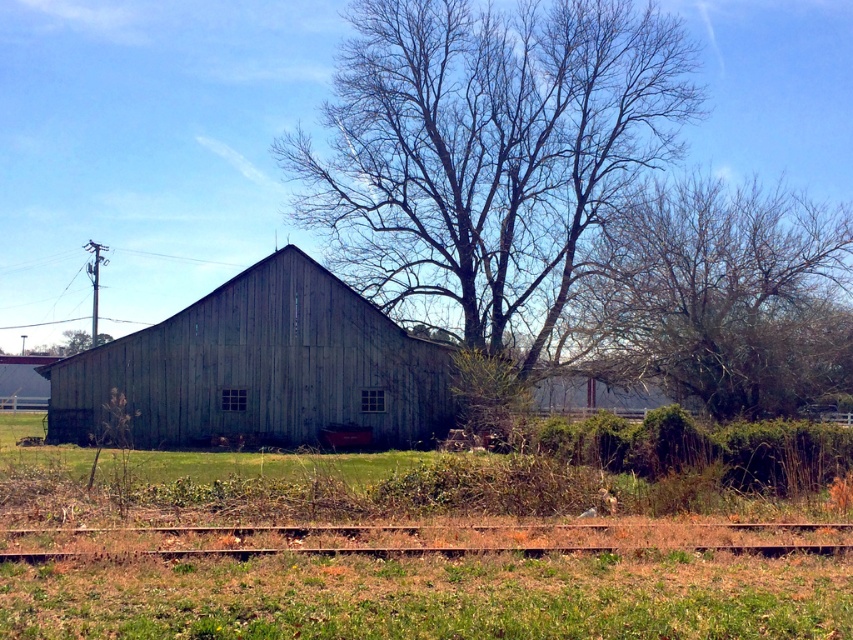
Question: Which point is farther to the camera?

Choices:
 (A) smooth gray bark tree at center
 (B) weathered wood barn at center

Answer: (A)

Question: Does weathered wood barn at center come in front of rusty metal train track at lower center?

Choices:
 (A) no
 (B) yes

Answer: (A)

Question: Can you confirm if smooth gray bark tree at center is positioned above brown textured tree at upper right?

Choices:
 (A) yes
 (B) no

Answer: (A)

Question: Based on their relative distances, which object is farther from the brown textured tree at upper right?

Choices:
 (A) weathered wood barn at center
 (B) smooth gray bark tree at center
 (C) rusty metal train track at lower center

Answer: (C)

Question: Observing the image, what is the correct spatial positioning of smooth gray bark tree at center in reference to rusty metal train track at lower center?

Choices:
 (A) below
 (B) above

Answer: (B)

Question: Based on their relative distances, which object is nearer to the brown textured tree at upper right?

Choices:
 (A) rusty metal train track at lower center
 (B) smooth gray bark tree at center

Answer: (B)